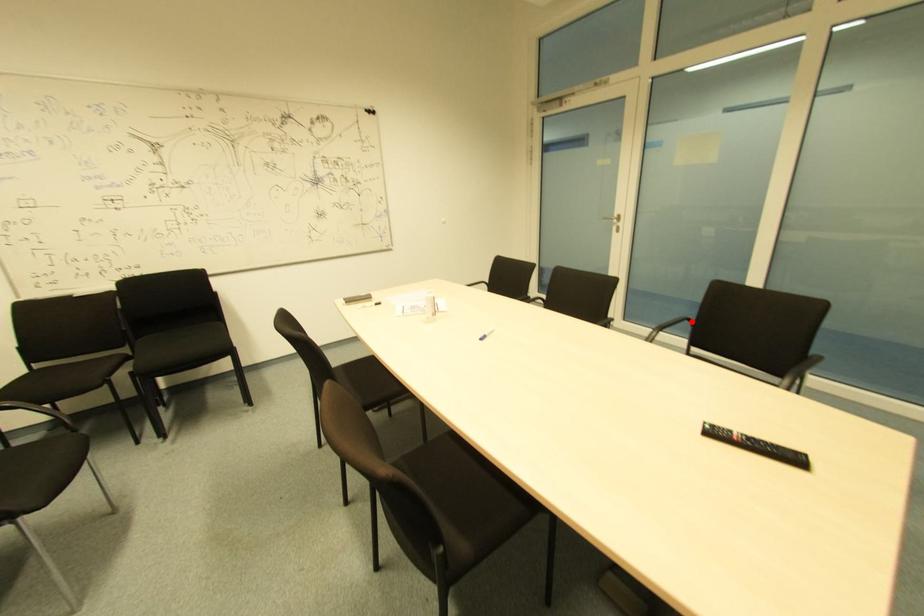
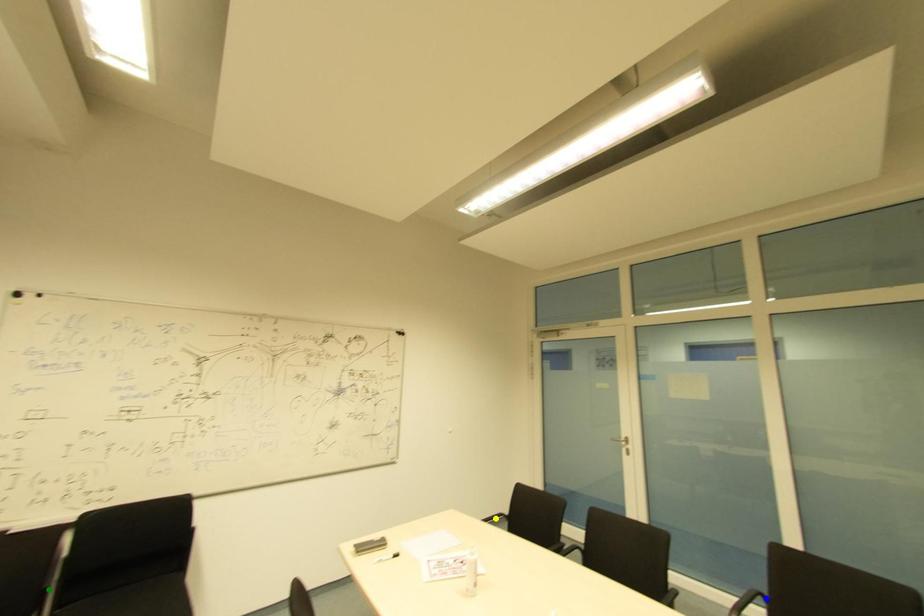
Question: I am providing you with two images of the same scene from different viewpoints. A red point is marked on the first image. You are given multiple points on the second image. Which point in image 2 represents the same 3d spot as the red point in image 1?

Choices:
 (A) yellow point
 (B) blue point
 (C) green point

Answer: (B)